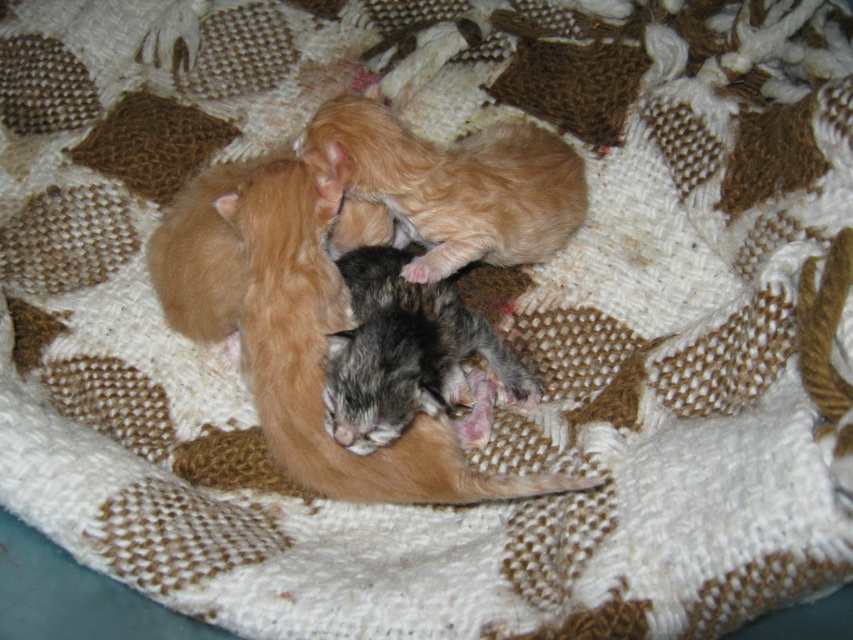
Is fuzzy orange cat at upper center to the right of gray fur kitten at center from the viewer's perspective?

Correct, you'll find fuzzy orange cat at upper center to the right of gray fur kitten at center.

Is fuzzy orange cat at upper center thinner than gray fur kitten at center?

No, fuzzy orange cat at upper center is not thinner than gray fur kitten at center.

Which is in front, point (540, 170) or point (335, 424)?

Point (335, 424) is more forward.

Image resolution: width=853 pixels, height=640 pixels. I want to click on fuzzy orange cat at upper center, so click(x=453, y=182).

Who is more forward, (466,476) or (360,444)?

Positioned in front is point (360,444).

Consider the image. Who is taller, gray fluffy kitten at center or gray fur kitten at center?

Standing taller between the two is gray fluffy kitten at center.

Describe the element at coordinates (323, 355) in the screenshot. This screenshot has height=640, width=853. I see `gray fluffy kitten at center` at that location.

Identify the location of gray fluffy kitten at center. The width and height of the screenshot is (853, 640). (323, 355).

Does point (262, 193) come in front of point (383, 138)?

That is True.

Between gray fluffy kitten at center and fuzzy orange cat at upper center, which one is positioned lower?

gray fluffy kitten at center is below.

Which is behind, point (308, 481) or point (392, 124)?

The point (392, 124) is behind.

Where is `gray fluffy kitten at center`? The width and height of the screenshot is (853, 640). gray fluffy kitten at center is located at coordinates (323, 355).